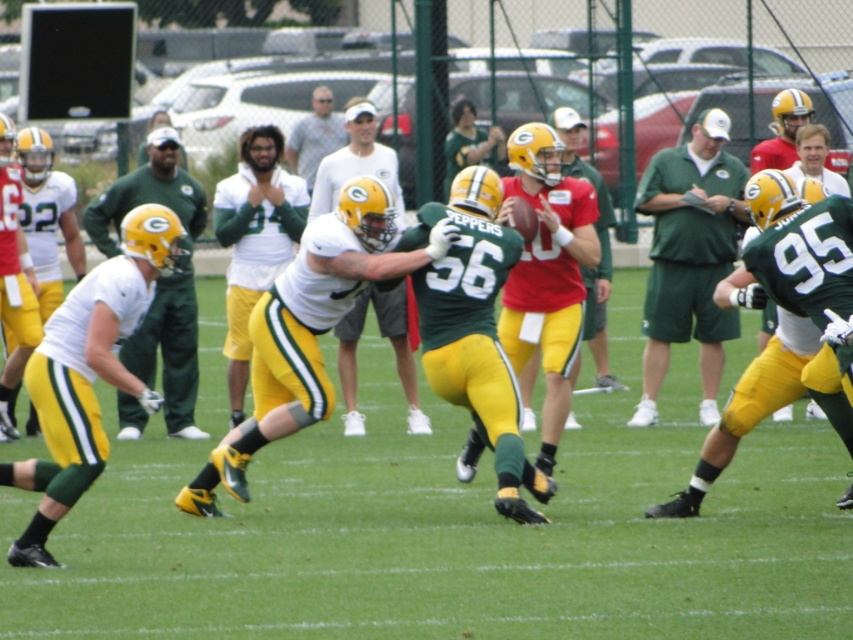
Question: Is white matte jersey at left to the right of white matte helmet at center from the viewer's perspective?

Choices:
 (A) yes
 (B) no

Answer: (A)

Question: Which point appears closest to the camera in this image?

Choices:
 (A) (703, 454)
 (B) (665, 164)
 (C) (293, 294)
 (D) (341, 339)

Answer: (A)

Question: Based on their relative distances, which object is nearer to the red jersey at center?

Choices:
 (A) white matte jersey at center
 (B) white matte helmet at center
 (C) matte green shorts at center

Answer: (C)

Question: Can you confirm if white matte jersey at center is positioned to the right of matte green helmet at center?

Choices:
 (A) no
 (B) yes

Answer: (A)

Question: Does white matte helmet at center appear under matte green helmet at center?

Choices:
 (A) no
 (B) yes

Answer: (A)

Question: Which object is positioned farthest from the red jersey at center?

Choices:
 (A) green matte jersey at center
 (B) white matte jersey at left

Answer: (B)